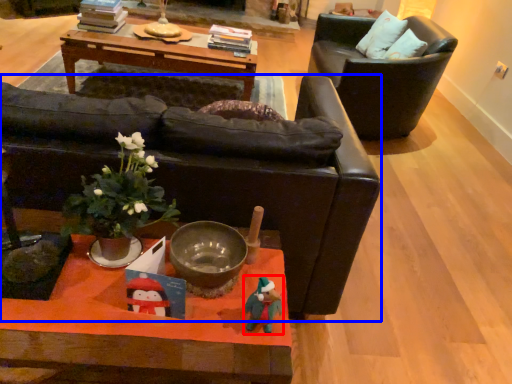
Question: Which of the following is the closest to the observer, toy (highlighted by a red box) or chair (highlighted by a blue box)?

Choices:
 (A) toy
 (B) chair

Answer: (A)